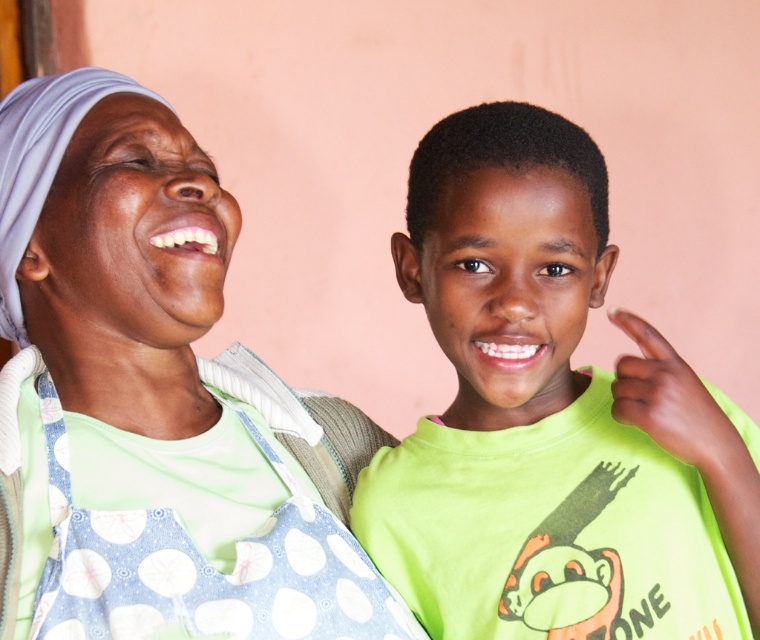
Who is taller, polka dot apron at left or green matte shirt at center?

polka dot apron at left is taller.

The height and width of the screenshot is (640, 760). In order to click on polka dot apron at left in this screenshot , I will do `click(146, 397)`.

Does green matte shirt at center have a larger size compared to blue polka dot fabric apron at center?

Yes, green matte shirt at center is bigger than blue polka dot fabric apron at center.

Is point (429, 168) positioned before point (244, 564)?

Yes, point (429, 168) is in front of point (244, 564).

Find the location of a particular element. Image resolution: width=760 pixels, height=640 pixels. green matte shirt at center is located at coordinates (551, 417).

Is polka dot apron at left in front of blue polka dot fabric apron at center?

Yes, it is in front of blue polka dot fabric apron at center.

Which is below, polka dot apron at left or blue polka dot fabric apron at center?

blue polka dot fabric apron at center

Is point (192, 483) in front of point (57, 445)?

No, it is behind (57, 445).

Where is `polka dot apron at left`? The image size is (760, 640). polka dot apron at left is located at coordinates (146, 397).